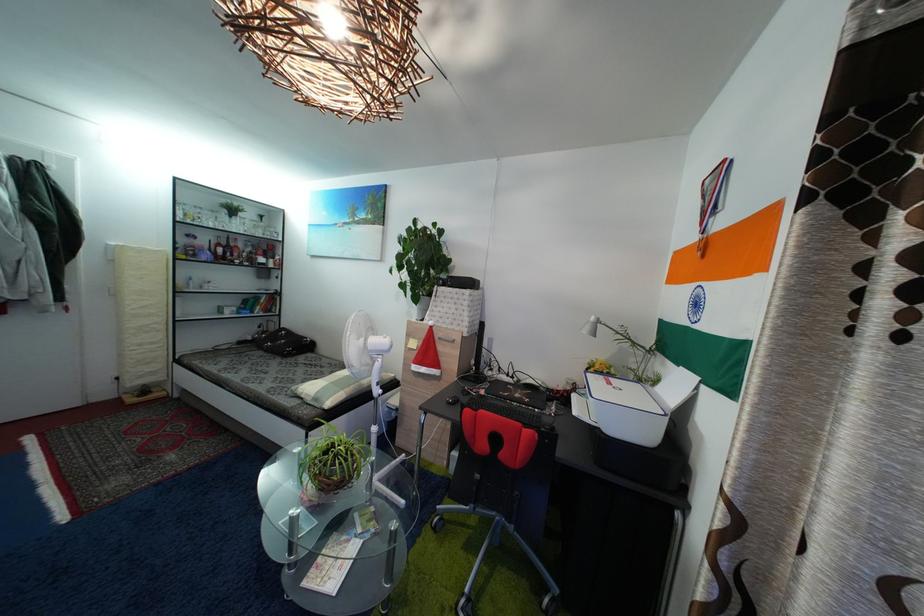
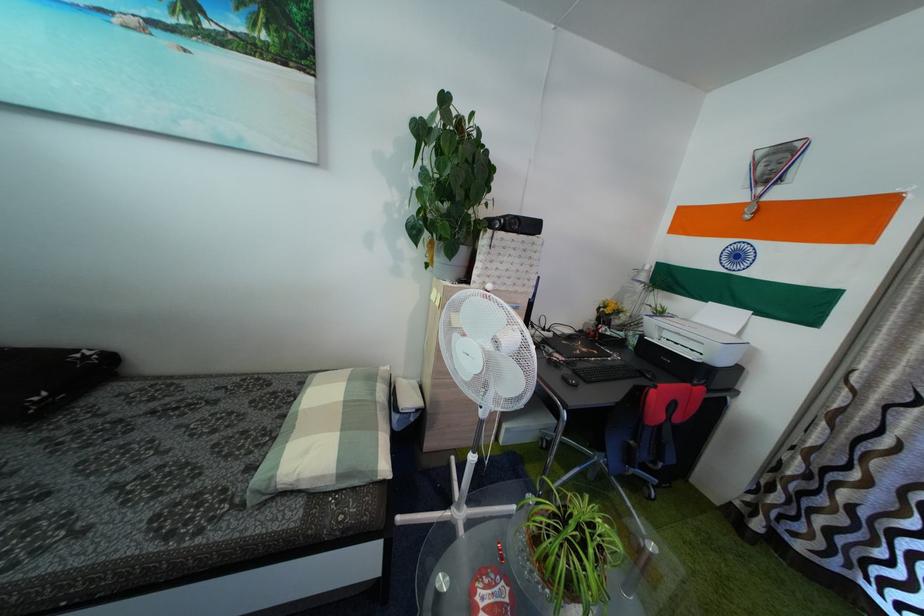
Question: I am providing you with two images of the same scene from different viewpoints. After the viewpoint changes to image2, which objects are now occluded?

Choices:
 (A) plaid checkered pillow
 (B) black computer keyboard
 (C) grey plant pot
 (D) none of these

Answer: (D)